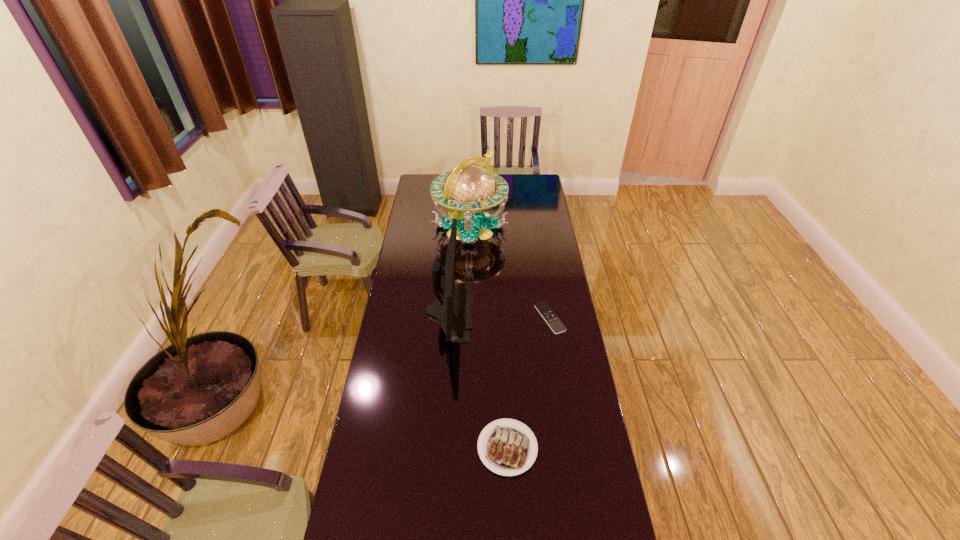
Where is `vacant space that satisfies the following two spatial constraints: 1. on the front side of the plate; 2. on the left side of the farthest object`? vacant space that satisfies the following two spatial constraints: 1. on the front side of the plate; 2. on the left side of the farthest object is located at coordinates (464, 448).

Locate an element on the screen. vacant space that satisfies the following two spatial constraints: 1. on the screen side of the plate; 2. on the left side of the third shortest object is located at coordinates (441, 448).

Image resolution: width=960 pixels, height=540 pixels. Identify the location of vacant space that satisfies the following two spatial constraints: 1. on the screen side of the monitor; 2. on the back side of the nearest object. pos(441,448).